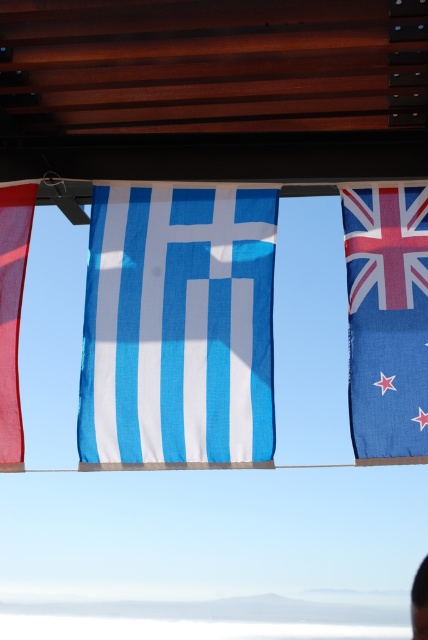
You are standing in front of three flags displayed under a wooden structure. You notice the matte red flag at left and the black plastic person at lower right. Which object has a greater width?

The matte red flag at left has a greater width than the black plastic person at lower right.

You are standing under the wooden structure where the flags are displayed. Looking up, you see the blue fabric flag at center and the blue fabric flag at right. Which flag is positioned lower in the arrangement?

The blue fabric flag at center is located below the blue fabric flag at right, so it is positioned lower.